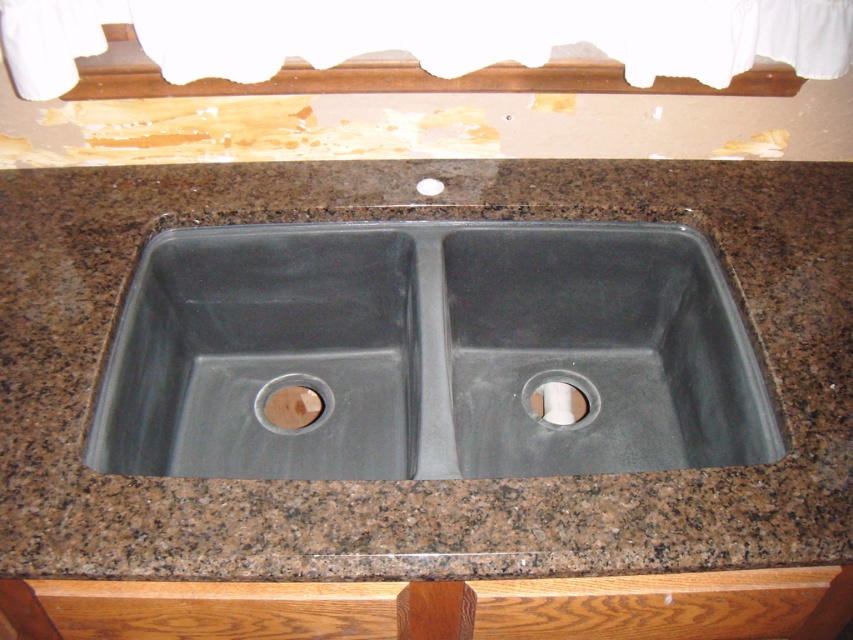
Can you confirm if matte gray drain at center is smaller than wooden circular drain at center?

Actually, matte gray drain at center might be larger than wooden circular drain at center.

Does matte gray drain at center appear on the right side of wooden circular drain at center?

Indeed, matte gray drain at center is positioned on the right side of wooden circular drain at center.

Is point (589, 417) positioned in front of point (254, 400)?

Yes, it is.

What are the coordinates of `matte gray drain at center` in the screenshot? It's located at (570, 396).

Can you confirm if gray matte sink at center is thinner than matte gray drain at center?

No.

Who is positioned more to the left, gray matte sink at center or matte gray drain at center?

gray matte sink at center

Is point (653, 328) behind point (595, 408)?

Yes, it is behind point (595, 408).

Find the location of a particular element. Image resolution: width=853 pixels, height=640 pixels. gray matte sink at center is located at coordinates (428, 352).

Based on the photo, is gray matte sink at center below wooden circular drain at center?

No.

Which is more to the left, gray matte sink at center or wooden circular drain at center?

wooden circular drain at center

Locate an element on the screen. The width and height of the screenshot is (853, 640). gray matte sink at center is located at coordinates (428, 352).

Where is `gray matte sink at center`? gray matte sink at center is located at coordinates (428, 352).